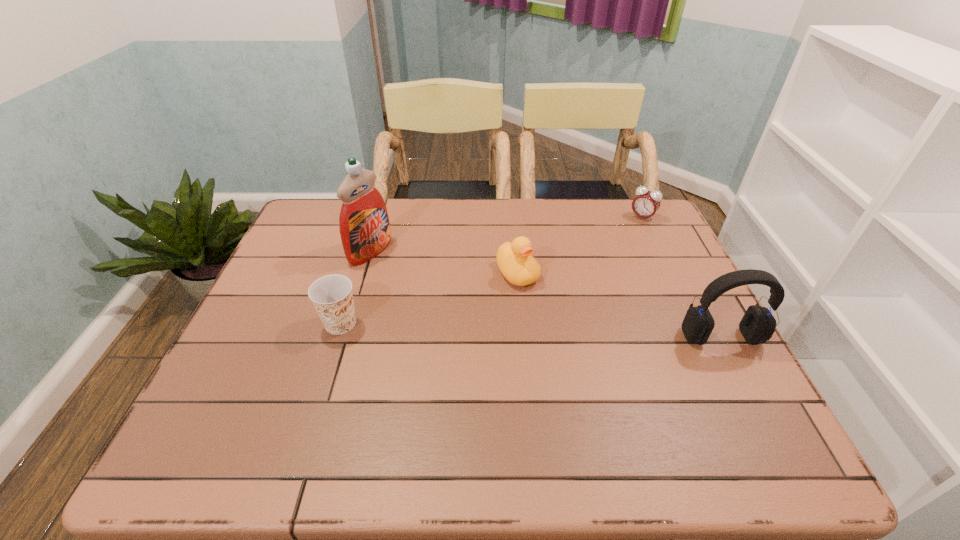
In order to click on free space on the desktop that is between the Dixie cup and the second tallest object and is positioned on the face of the duck in this screenshot , I will do `click(569, 332)`.

The height and width of the screenshot is (540, 960). What are the coordinates of `vacant space on the desktop that is between the Dixie cup and the second tallest object and is positioned on the clock face of the farthest object` in the screenshot? It's located at (554, 331).

I want to click on vacant space on the desktop that is between the Dixie cup and the fourth shortest object and is positioned on the front surface of the tallest object, so click(x=540, y=330).